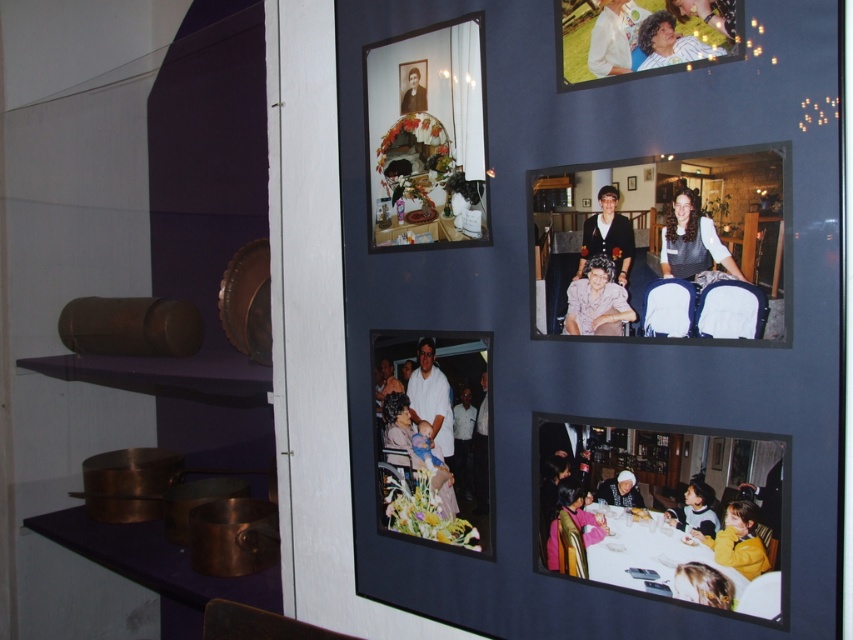
You are standing in the room and see the white glossy table at lower right and the yellow fleece jacket at lower right. Which object is positioned lower in the image?

The white glossy table at lower right is positioned lower than the yellow fleece jacket at lower right.

You are hanging a new picture on the wall display. The new picture has a matte white shirt at upper right and a matte plastic photo frame at upper center. According to the current arrangement, which object should you place to the left of the other?

The matte plastic photo frame at upper center should be placed to the left of the matte white shirt at upper right because the description states that the matte plastic photo frame at upper center is to the left of the matte white shirt at upper right.